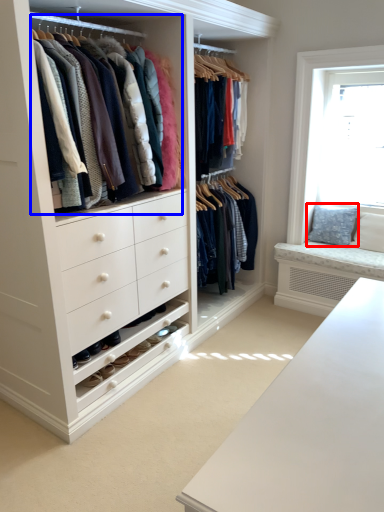
Question: Which object is further to the camera taking this photo, pillow (highlighted by a red box) or closet (highlighted by a blue box)?

Choices:
 (A) pillow
 (B) closet

Answer: (A)